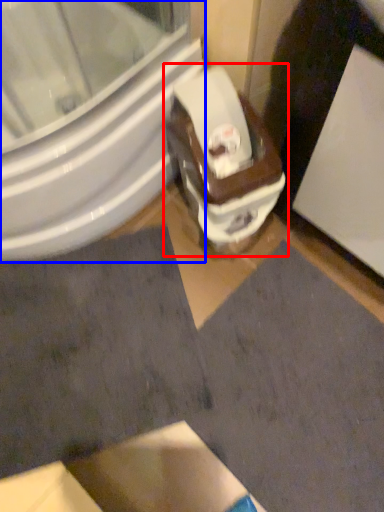
Question: Which point is further to the camera, toilet (highlighted by a red box) or bidet (highlighted by a blue box)?

Choices:
 (A) toilet
 (B) bidet

Answer: (A)